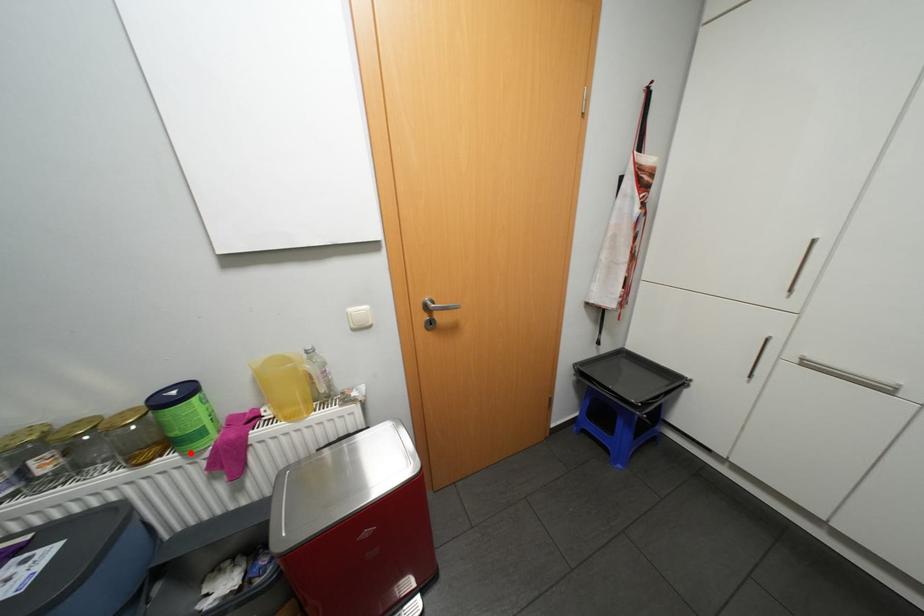
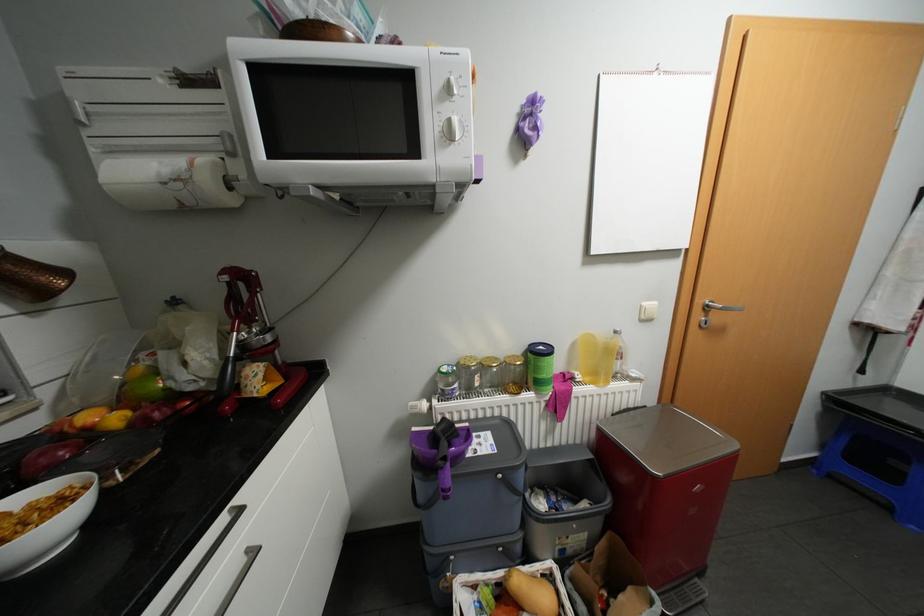
Find the pixel in the second image that matches the highlighted location in the first image.

(544, 392)